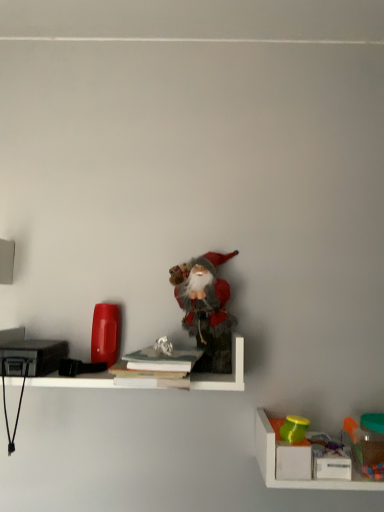
Question: Is translucent plastic container at lower right, positioned as the 3th toy in left-to-right order, inside hardcover book at center, which ranks as the second book in top-to-bottom order?

Choices:
 (A) no
 (B) yes

Answer: (A)

Question: Considering the relative sizes of hardcover book at center, which ranks as the second book in top-to-bottom order, and translucent plastic container at lower right, acting as the first toy starting from the right, in the image provided, is hardcover book at center, which ranks as the second book in top-to-bottom order, thinner than translucent plastic container at lower right, acting as the first toy starting from the right,?

Choices:
 (A) no
 (B) yes

Answer: (A)

Question: Does hardcover book at center, the 1th book positioned from the bottom, appear on the right side of translucent plastic container at lower right, positioned as the 3th toy in left-to-right order?

Choices:
 (A) yes
 (B) no

Answer: (B)

Question: Is hardcover book at center, which ranks as the second book in top-to-bottom order, wider than translucent plastic container at lower right, which is the 1th toy in bottom-to-top order?

Choices:
 (A) yes
 (B) no

Answer: (A)

Question: Is hardcover book at center, which ranks as the second book in top-to-bottom order, positioned before translucent plastic container at lower right, positioned as the 3th toy in left-to-right order?

Choices:
 (A) yes
 (B) no

Answer: (A)

Question: Can you confirm if hardcover book at center, which ranks as the second book in top-to-bottom order, is bigger than translucent plastic container at lower right, which is the 1th toy in bottom-to-top order?

Choices:
 (A) no
 (B) yes

Answer: (A)

Question: Would you say fuzzy fabric santa at center, arranged as the 1th toy when viewed from the top, contains white matte shelf at center, which is the second shelf in right-to-left order?

Choices:
 (A) yes
 (B) no

Answer: (B)

Question: Considering the relative sizes of fuzzy fabric santa at center, the first toy from the left, and white matte shelf at center, the second shelf ordered from the bottom, in the image provided, is fuzzy fabric santa at center, the first toy from the left, thinner than white matte shelf at center, the second shelf ordered from the bottom,?

Choices:
 (A) no
 (B) yes

Answer: (B)

Question: Is fuzzy fabric santa at center, arranged as the third toy when viewed from the right, directly adjacent to white matte shelf at center, positioned as the first shelf in top-to-bottom order?

Choices:
 (A) no
 (B) yes

Answer: (A)

Question: Considering the relative sizes of fuzzy fabric santa at center, arranged as the 1th toy when viewed from the top, and white matte shelf at center, which is counted as the 1th shelf, starting from the left, in the image provided, is fuzzy fabric santa at center, arranged as the 1th toy when viewed from the top, taller than white matte shelf at center, which is counted as the 1th shelf, starting from the left,?

Choices:
 (A) yes
 (B) no

Answer: (A)

Question: From the image's perspective, does fuzzy fabric santa at center, arranged as the 1th toy when viewed from the top, appear lower than white matte shelf at center, the second shelf ordered from the bottom?

Choices:
 (A) yes
 (B) no

Answer: (B)

Question: From the image's perspective, does matte green cup at lower right, which is the 2th toy in left-to-right order, appear lower than hardcover book at center, the 1th book positioned from the bottom?

Choices:
 (A) no
 (B) yes

Answer: (B)